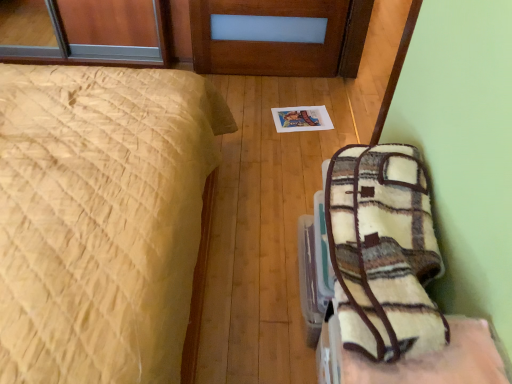
Question: From the image's perspective, is yellow quilted bed at left below plush fleece blanket at lower right?

Choices:
 (A) yes
 (B) no

Answer: (B)

Question: Does yellow quilted bed at left lie behind plush fleece blanket at lower right?

Choices:
 (A) no
 (B) yes

Answer: (A)

Question: Can you confirm if yellow quilted bed at left is shorter than plush fleece blanket at lower right?

Choices:
 (A) yes
 (B) no

Answer: (B)

Question: From the image's perspective, would you say yellow quilted bed at left is positioned over plush fleece blanket at lower right?

Choices:
 (A) yes
 (B) no

Answer: (A)

Question: Can you confirm if yellow quilted bed at left is bigger than plush fleece blanket at lower right?

Choices:
 (A) yes
 (B) no

Answer: (A)

Question: Is yellow quilted bed at left next to plush fleece blanket at lower right?

Choices:
 (A) no
 (B) yes

Answer: (A)

Question: From the image's perspective, is plush fleece blanket at lower right located above white fuzzy blanket at lower right?

Choices:
 (A) no
 (B) yes

Answer: (A)

Question: From the image's perspective, is plush fleece blanket at lower right beneath white fuzzy blanket at lower right?

Choices:
 (A) yes
 (B) no

Answer: (A)

Question: Is plush fleece blanket at lower right wider than white fuzzy blanket at lower right?

Choices:
 (A) no
 (B) yes

Answer: (B)

Question: Is plush fleece blanket at lower right positioned with its back to white fuzzy blanket at lower right?

Choices:
 (A) no
 (B) yes

Answer: (A)

Question: Can you confirm if plush fleece blanket at lower right is smaller than white fuzzy blanket at lower right?

Choices:
 (A) no
 (B) yes

Answer: (B)

Question: From a real-world perspective, is plush fleece blanket at lower right physically above white fuzzy blanket at lower right?

Choices:
 (A) yes
 (B) no

Answer: (B)

Question: Does white fuzzy blanket at lower right have a lesser width compared to plush fleece blanket at lower right?

Choices:
 (A) no
 (B) yes

Answer: (B)